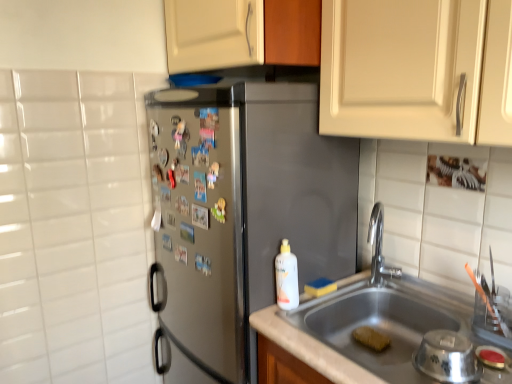
Question: From a real-world perspective, is yellow sponge at sink, placed as the 1th food when sorted from top to bottom, positioned under polished chrome faucet at sink right based on gravity?

Choices:
 (A) yes
 (B) no

Answer: (A)

Question: Does yellow sponge at sink, which is counted as the 2th food, starting from the right, have a lesser width compared to polished chrome faucet at sink right?

Choices:
 (A) no
 (B) yes

Answer: (B)

Question: Does yellow sponge at sink, which is the 1th food in left-to-right order, have a greater width compared to polished chrome faucet at sink right?

Choices:
 (A) no
 (B) yes

Answer: (A)

Question: Is yellow sponge at sink, which is counted as the 2th food, starting from the right, smaller than polished chrome faucet at sink right?

Choices:
 (A) yes
 (B) no

Answer: (A)

Question: Is yellow sponge at sink, placed as the 1th food when sorted from top to bottom, turned away from polished chrome faucet at sink right?

Choices:
 (A) no
 (B) yes

Answer: (A)

Question: Are yellow sponge at sink, the 2th food positioned from the bottom, and polished chrome faucet at sink right far apart?

Choices:
 (A) yes
 (B) no

Answer: (B)

Question: Is yellow sponge at sink, which is the 1th food in left-to-right order, thinner than satin steel refrigerator at center?

Choices:
 (A) no
 (B) yes

Answer: (B)

Question: Is yellow sponge at sink, which is counted as the 2th food, starting from the right, completely or partially outside of satin steel refrigerator at center?

Choices:
 (A) yes
 (B) no

Answer: (A)

Question: Can you confirm if yellow sponge at sink, placed as the 1th food when sorted from top to bottom, is bigger than satin steel refrigerator at center?

Choices:
 (A) no
 (B) yes

Answer: (A)

Question: Is yellow sponge at sink, which is counted as the 2th food, starting from the right, wider than satin steel refrigerator at center?

Choices:
 (A) no
 (B) yes

Answer: (A)

Question: Is yellow sponge at sink, which is counted as the 2th food, starting from the right, directly adjacent to satin steel refrigerator at center?

Choices:
 (A) yes
 (B) no

Answer: (B)

Question: Does yellow sponge at sink, which is counted as the 2th food, starting from the right, have a lesser height compared to satin steel refrigerator at center?

Choices:
 (A) yes
 (B) no

Answer: (A)

Question: Is yellow sponge at sink bottom, which is the 1th food from right to left, far from satin steel refrigerator at center?

Choices:
 (A) yes
 (B) no

Answer: (B)